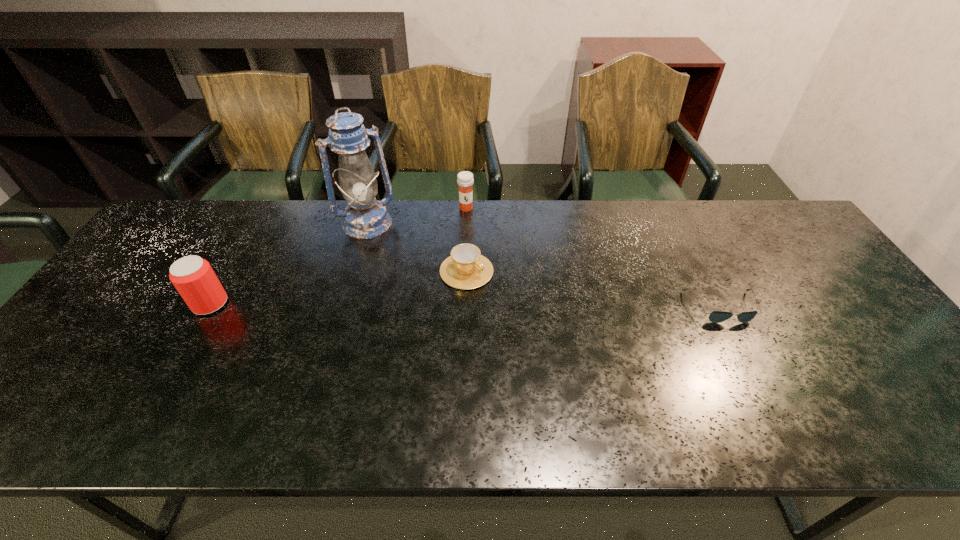
Where is `medicine that is at the far edge`? This screenshot has height=540, width=960. medicine that is at the far edge is located at coordinates (465, 180).

Identify the location of free spot at the far edge of the desktop. (570, 201).

In the image, there is a desktop. Identify the location of free space at the near edge. (375, 398).

Where is `vacant space at the left edge of the desktop`? This screenshot has height=540, width=960. vacant space at the left edge of the desktop is located at coordinates (96, 313).

You are a GUI agent. You are given a task and a screenshot of the screen. Output one action in this format:
    pyautogui.click(x=<x>, y=<y>)
    Task: Click on the vacant space at the right edge of the desktop
    The width and height of the screenshot is (960, 540).
    Given the screenshot: What is the action you would take?
    pyautogui.click(x=835, y=290)

Image resolution: width=960 pixels, height=540 pixels. In order to click on free space at the far left corner of the desktop in this screenshot , I will do `click(156, 247)`.

Locate an element on the screen. vacant space at the far right corner of the desktop is located at coordinates (801, 230).

Locate an element on the screen. vacant point located between the medicine and the leftmost object is located at coordinates (338, 256).

This screenshot has height=540, width=960. Find the location of `free space between the fourth tallest object and the shortest object`. free space between the fourth tallest object and the shortest object is located at coordinates (594, 289).

Find the location of a particular element. The height and width of the screenshot is (540, 960). free space between the rightmost object and the medicine is located at coordinates click(594, 258).